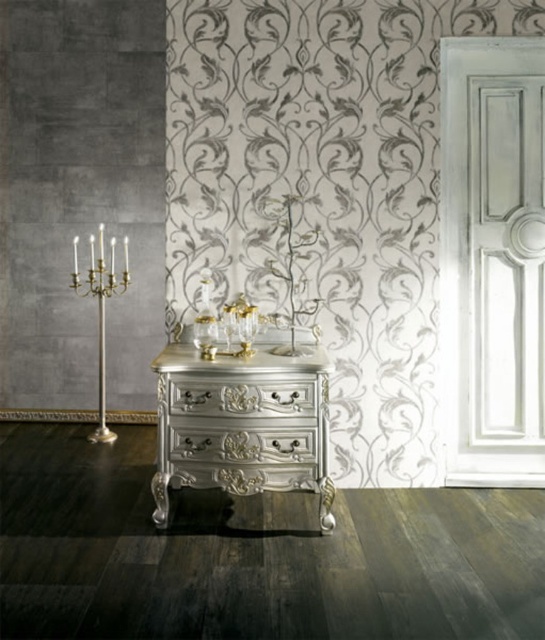
Is silver polished wood vanity at center above gold polished brass candle holder at left?

Incorrect, silver polished wood vanity at center is not positioned above gold polished brass candle holder at left.

Looking at this image, does silver polished wood vanity at center have a greater width compared to gold polished brass candle holder at left?

Correct, the width of silver polished wood vanity at center exceeds that of gold polished brass candle holder at left.

Does point (186, 465) come behind point (74, 240)?

No, it is in front of (74, 240).

This screenshot has width=545, height=640. In order to click on silver polished wood vanity at center in this screenshot , I will do `click(243, 424)`.

Is the position of silver polished wood drawer at center less distant than that of gold polished brass candle holder at left?

Yes, silver polished wood drawer at center is closer to the viewer.

Can you confirm if silver polished wood drawer at center is wider than gold polished brass candle holder at left?

Yes.

Which is behind, point (269, 410) or point (93, 250)?

The point (93, 250) is more distant.

Identify the location of silver polished wood drawer at center. (241, 397).

Consider the image. Can you confirm if silver polished wood vanity at center is positioned above silver polished drawer at center?

Indeed, silver polished wood vanity at center is positioned over silver polished drawer at center.

Which is above, silver polished wood vanity at center or silver polished drawer at center?

silver polished wood vanity at center

The width and height of the screenshot is (545, 640). Identify the location of silver polished wood vanity at center. (243, 424).